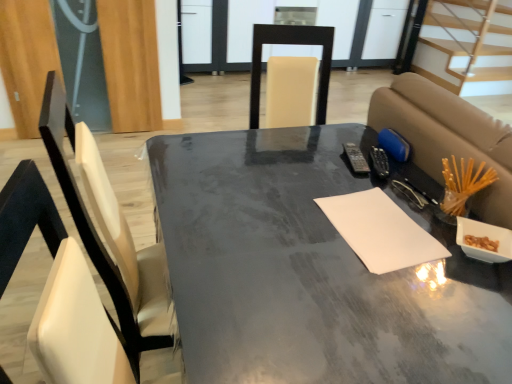
Question: Would you say white paper at center is inside or outside matte gray table at center?

Choices:
 (A) outside
 (B) inside

Answer: (B)

Question: Visually, is white paper at center positioned to the left or to the right of matte gray table at center?

Choices:
 (A) left
 (B) right

Answer: (B)

Question: Considering the real-world distances, which object is farthest from the matte gray table at center?

Choices:
 (A) light wood stairs at upper right
 (B) white paper at center

Answer: (A)

Question: Estimate the real-world distances between objects in this image. Which object is closer to the light wood stairs at upper right?

Choices:
 (A) matte gray table at center
 (B) white paper at center

Answer: (A)